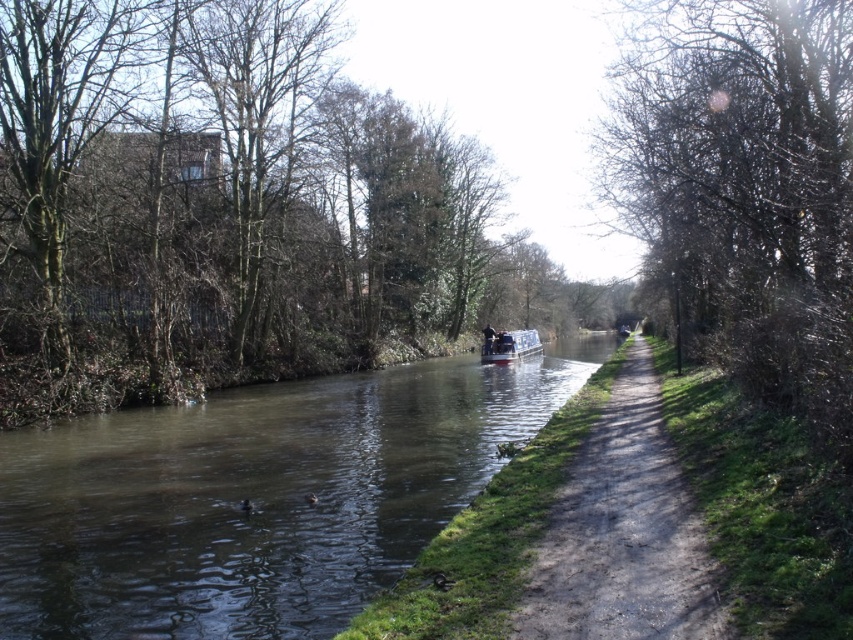
Is point (820, 364) positioned before point (523, 348)?

Yes, it is.

Which is in front, point (827, 108) or point (511, 342)?

Point (827, 108)

Image resolution: width=853 pixels, height=640 pixels. Describe the element at coordinates (746, 186) in the screenshot. I see `bare branches at right` at that location.

Find the location of `bare branches at right`. bare branches at right is located at coordinates (746, 186).

Is greenish reflective water at center shorter than white plastic boat at center?

Correct, greenish reflective water at center is not as tall as white plastic boat at center.

This screenshot has height=640, width=853. Describe the element at coordinates (257, 497) in the screenshot. I see `greenish reflective water at center` at that location.

Identify the location of greenish reflective water at center. (257, 497).

Can you confirm if greenish reflective water at center is bigger than dirt path at right?

Indeed, greenish reflective water at center has a larger size compared to dirt path at right.

Between point (294, 438) and point (648, 512), which one is positioned in front?

Point (648, 512) is more forward.

Locate an element on the screen. The width and height of the screenshot is (853, 640). greenish reflective water at center is located at coordinates (257, 497).